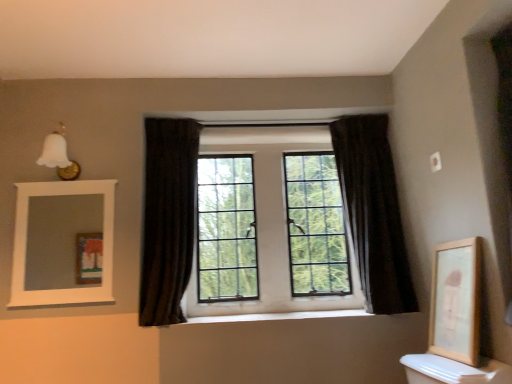
Question: In the image, is white wooden mirror at upper left on the left side or the right side of dark fabric curtain at center, the 2th curtain positioned from the left?

Choices:
 (A) left
 (B) right

Answer: (A)

Question: From a real-world perspective, is white wooden mirror at upper left physically located above or below dark fabric curtain at center, arranged as the first curtain when viewed from the right?

Choices:
 (A) below
 (B) above

Answer: (A)

Question: Which of these objects is positioned farthest from the white wooden mirror at upper left?

Choices:
 (A) dark fabric curtain at center, arranged as the first curtain when viewed from the right
 (B) white smooth window sill at center
 (C) clear glass windows at center
 (D) wooden framed artwork at right
 (E) dark velvet curtain at center, acting as the first curtain starting from the left

Answer: (D)

Question: Which object is positioned closest to the clear glass windows at center?

Choices:
 (A) dark fabric curtain at center, the 2th curtain positioned from the left
 (B) white smooth window sill at center
 (C) wooden framed artwork at right
 (D) white wooden mirror at upper left
 (E) dark velvet curtain at center, positioned as the 2th curtain in right-to-left order

Answer: (A)